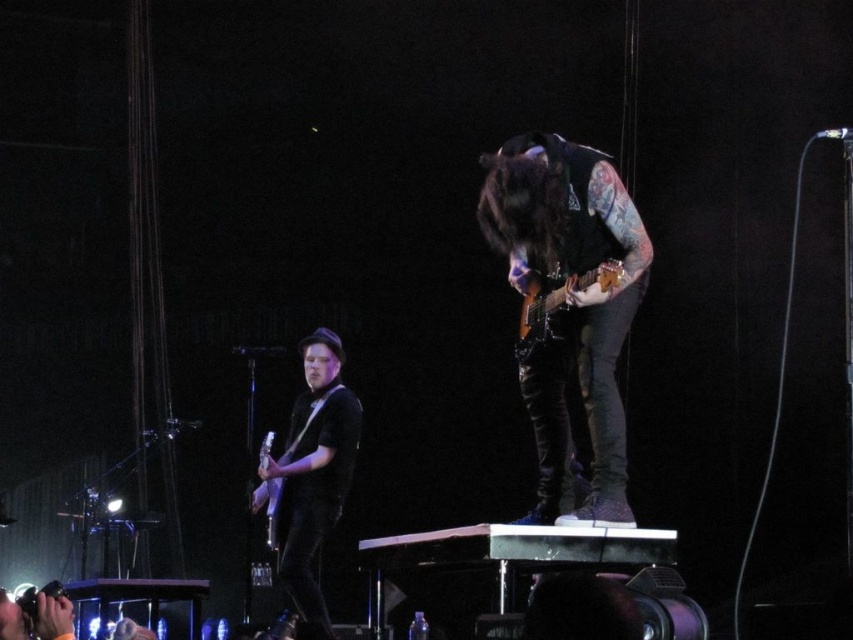
Question: Which of these objects is positioned farthest from the shiny black guitar at center?

Choices:
 (A) matte silver guitar at center
 (B) shiny brown electric guitar at center
 (C) matte black guitar at left

Answer: (A)

Question: Does matte black guitar at left appear on the right side of matte silver guitar at center?

Choices:
 (A) no
 (B) yes

Answer: (B)

Question: Which is farther from the matte black guitar at left?

Choices:
 (A) shiny black guitar at center
 (B) shiny brown electric guitar at center
 (C) matte silver guitar at center

Answer: (B)

Question: Does matte black guitar at left appear under shiny brown electric guitar at center?

Choices:
 (A) no
 (B) yes

Answer: (B)

Question: Considering the real-world distances, which object is closest to the shiny brown electric guitar at center?

Choices:
 (A) matte silver guitar at center
 (B) matte black guitar at left

Answer: (B)

Question: In this image, where is matte black guitar at left located relative to shiny brown electric guitar at center?

Choices:
 (A) below
 (B) above

Answer: (A)